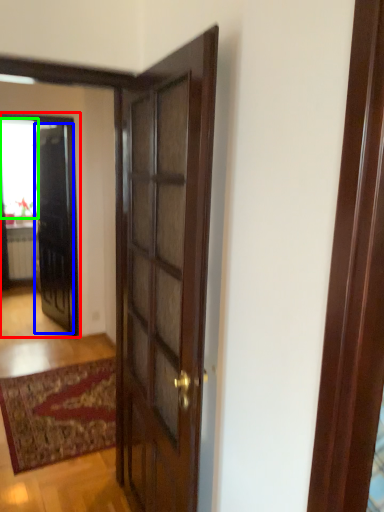
Question: Which is farther away from elevator (highlighted by a red box)? door (highlighted by a blue box) or window (highlighted by a green box)?

Choices:
 (A) door
 (B) window

Answer: (B)